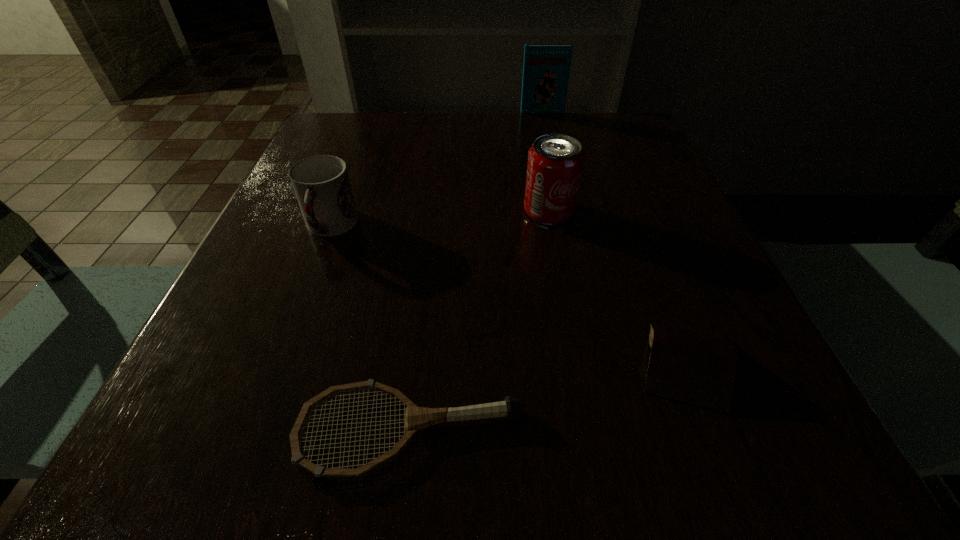
This screenshot has height=540, width=960. Identify the location of free space between the shortest object and the fourth tallest object. (546, 396).

Identify the location of vacant area that lies between the can and the second shortest object. The image size is (960, 540). (616, 287).

The image size is (960, 540). In order to click on vacant area that lies between the cup and the farther book in this screenshot , I will do `click(436, 170)`.

The height and width of the screenshot is (540, 960). Find the location of `unoccupied area between the second shortest object and the third shortest object`. unoccupied area between the second shortest object and the third shortest object is located at coordinates (507, 295).

Identify the location of free space between the second object from left to right and the taller book. (475, 272).

Identify which object is located as the second nearest to the cup. Please provide its 2D coordinates. Your answer should be formatted as a tuple, i.e. [(x, y)], where the tuple contains the x and y coordinates of a point satisfying the conditions above.

[(555, 163)]

Where is `object identified as the fourth closest to the tennis racket`? This screenshot has height=540, width=960. object identified as the fourth closest to the tennis racket is located at coordinates (546, 69).

What are the coordinates of `vacant space that satisfies the following two spatial constraints: 1. on the side of the leftmost object where the handle is located; 2. on the left side of the second shortest object` in the screenshot? It's located at (278, 362).

Where is `free space in the image that satisfies the following two spatial constraints: 1. on the front cover of the taller book; 2. on the right side of the second shortest object`? free space in the image that satisfies the following two spatial constraints: 1. on the front cover of the taller book; 2. on the right side of the second shortest object is located at coordinates (598, 362).

Locate an element on the screen. vacant area that satisfies the following two spatial constraints: 1. on the side of the cup where the handle is located; 2. on the left side of the fourth object from right to left is located at coordinates (252, 430).